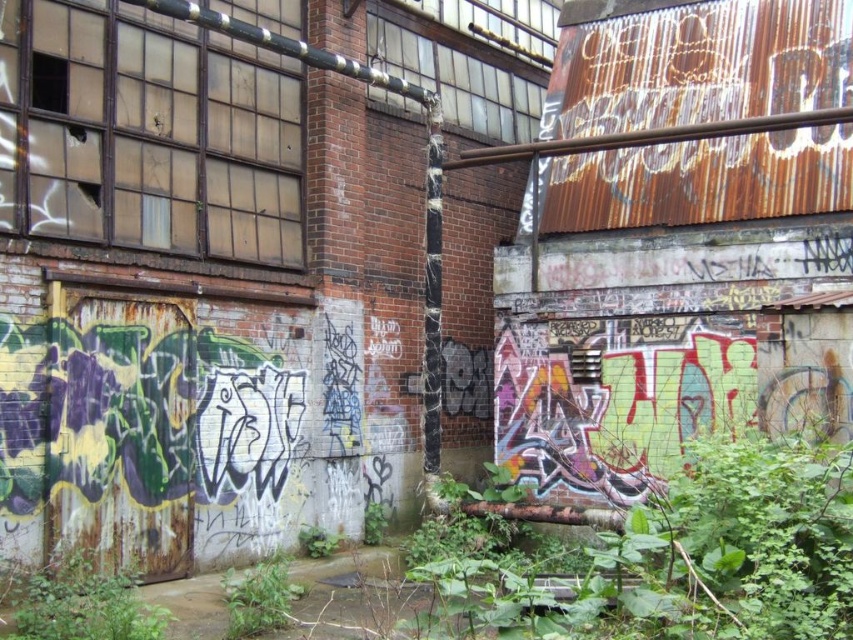
Does green leafy plant at lower left appear over green leafy plant at lower center?

Correct, green leafy plant at lower left is located above green leafy plant at lower center.

Between point (132, 589) and point (262, 584), which one is positioned in front?

Point (132, 589) is in front.

Find the location of a particular element. This screenshot has width=853, height=640. green leafy plant at lower left is located at coordinates (82, 604).